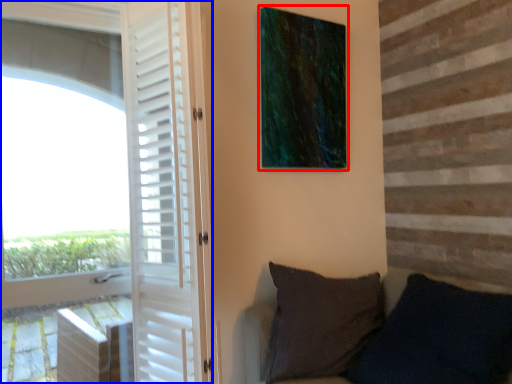
Question: Which object appears farthest to the camera in this image, picture frame (highlighted by a red box) or door (highlighted by a blue box)?

Choices:
 (A) picture frame
 (B) door

Answer: (A)